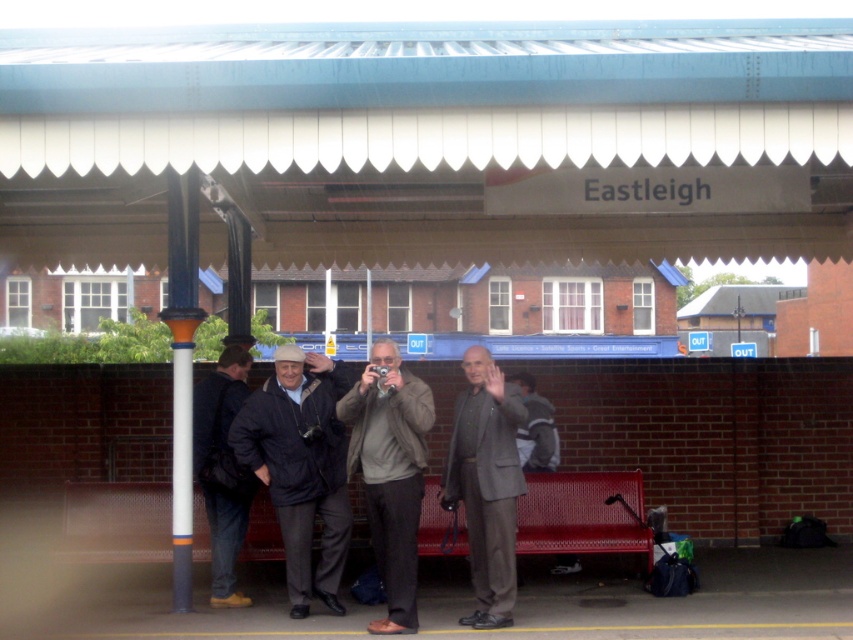
Question: Based on their relative distances, which object is nearer to the dark blue jeans at left?

Choices:
 (A) gray woolen jacket at center
 (B) matte black jacket at center
 (C) dark gray suit at center

Answer: (B)

Question: Which object is positioned farthest from the dark blue jeans at left?

Choices:
 (A) matte black jacket at center
 (B) dark gray suit at center

Answer: (B)

Question: Is the position of matte black jacket at center less distant than that of dark gray suit at center?

Choices:
 (A) yes
 (B) no

Answer: (B)

Question: Which point is farther to the camera?

Choices:
 (A) gray woolen jacket at center
 (B) dark blue jeans at left

Answer: (B)

Question: Does matte black jacket at center have a lesser width compared to gray woolen jacket at center?

Choices:
 (A) yes
 (B) no

Answer: (B)

Question: Is gray woolen jacket at center bigger than dark gray suit at center?

Choices:
 (A) no
 (B) yes

Answer: (A)